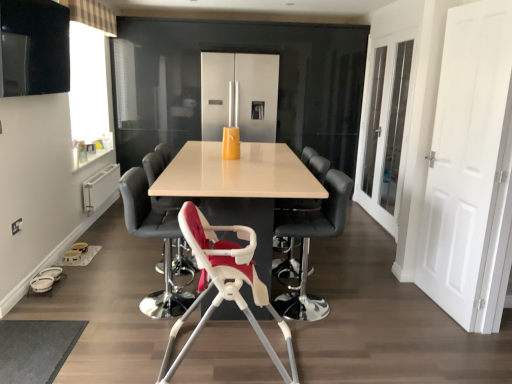
Where is `free point to the left of white matte door at right`? The image size is (512, 384). free point to the left of white matte door at right is located at coordinates (390, 302).